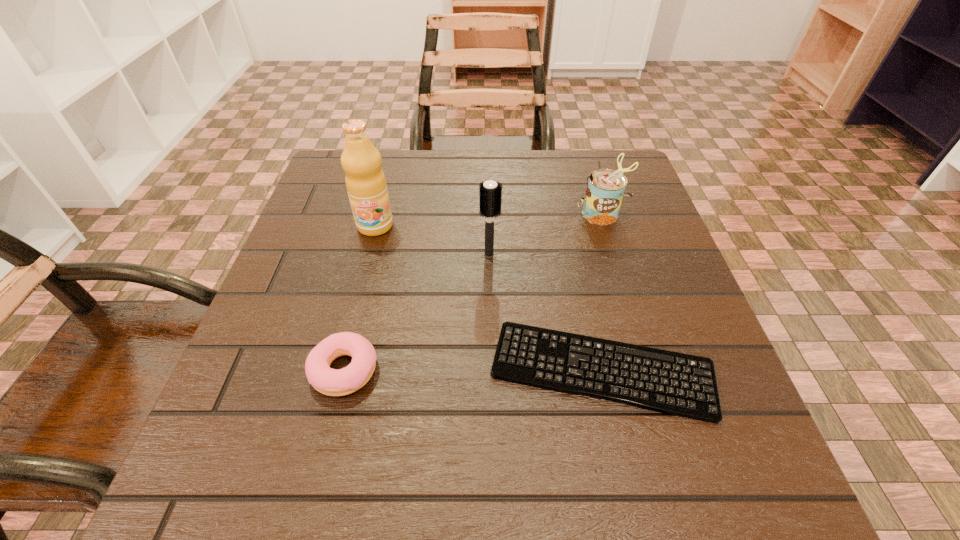
In the image, there is a desktop. What are the coordinates of `vacant space at the right edge` in the screenshot? It's located at (645, 274).

At what (x,y) coordinates should I click in order to perform the action: click on vacant space at the far left corner of the desktop. Please return your answer as a coordinate pair (x, y). The image size is (960, 540). Looking at the image, I should click on (391, 162).

In the image, there is a desktop. At what (x,y) coordinates should I click in order to perform the action: click on vacant space at the near left corner. Please return your answer as a coordinate pair (x, y). The image size is (960, 540). Looking at the image, I should click on (308, 487).

Find the location of a particular element. Image resolution: width=960 pixels, height=540 pixels. vacant region at the far right corner of the desktop is located at coordinates (579, 154).

Locate an element on the screen. empty space that is in between the fruit juice and the hairbrush is located at coordinates (432, 240).

The width and height of the screenshot is (960, 540). I want to click on free area in between the fruit juice and the doughnut, so click(x=360, y=298).

The image size is (960, 540). What are the coordinates of `unoccupied area between the computer keyboard and the doughnut` in the screenshot? It's located at (473, 370).

At what (x,y) coordinates should I click in order to perform the action: click on empty location between the can and the shortest object. Please return your answer as a coordinate pair (x, y). The height and width of the screenshot is (540, 960). Looking at the image, I should click on (602, 292).

The height and width of the screenshot is (540, 960). Find the location of `vacant space that is in between the computer keyboard and the third shortest object`. vacant space that is in between the computer keyboard and the third shortest object is located at coordinates (602, 292).

The height and width of the screenshot is (540, 960). What are the coordinates of `free space that is in between the second shortest object and the shortest object` in the screenshot? It's located at (473, 370).